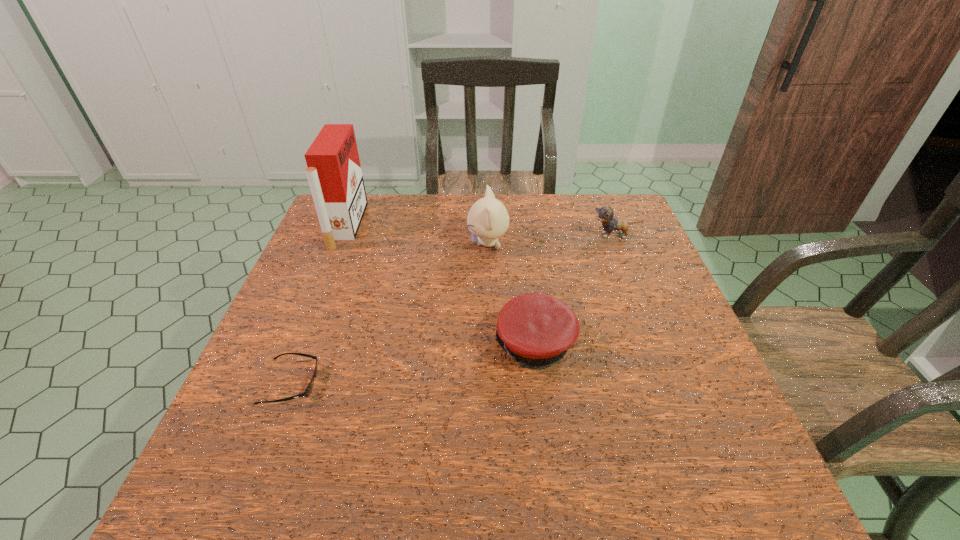
This screenshot has height=540, width=960. Identify the location of blank space located on the face of the taller kitten. (436, 243).

Find the location of a particular element. vacant space located on the front-facing side of the third tallest object is located at coordinates click(505, 235).

Locate an element on the screen. free region located on the front-facing side of the third tallest object is located at coordinates (553, 235).

Where is `vacant region located 0.300m on the front-facing side of the third tallest object`? The height and width of the screenshot is (540, 960). vacant region located 0.300m on the front-facing side of the third tallest object is located at coordinates (489, 235).

Locate an element on the screen. Image resolution: width=960 pixels, height=540 pixels. vacant space situated on the front-facing side of the cap is located at coordinates click(x=384, y=345).

I want to click on free point located on the front-facing side of the cap, so click(366, 345).

The height and width of the screenshot is (540, 960). I want to click on vacant space located on the front-facing side of the cap, so click(x=330, y=345).

Identify the location of free space located 0.280m on the front-facing side of the shortest object. The width and height of the screenshot is (960, 540). (454, 383).

Where is `cigarette case at the far edge`? Image resolution: width=960 pixels, height=540 pixels. cigarette case at the far edge is located at coordinates (334, 173).

Where is `cigarette case that is at the left edge`? The width and height of the screenshot is (960, 540). cigarette case that is at the left edge is located at coordinates (334, 173).